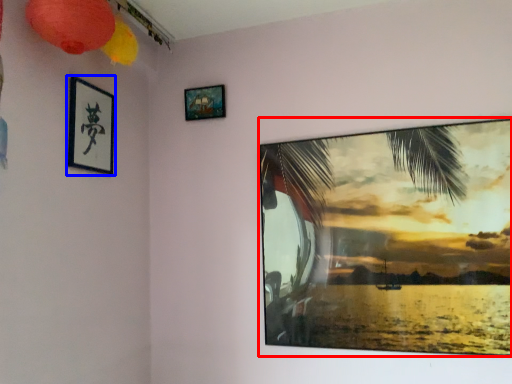
Question: Which point is closer to the camera, picture frame (highlighted by a red box) or picture frame (highlighted by a blue box)?

Choices:
 (A) picture frame
 (B) picture frame

Answer: (A)